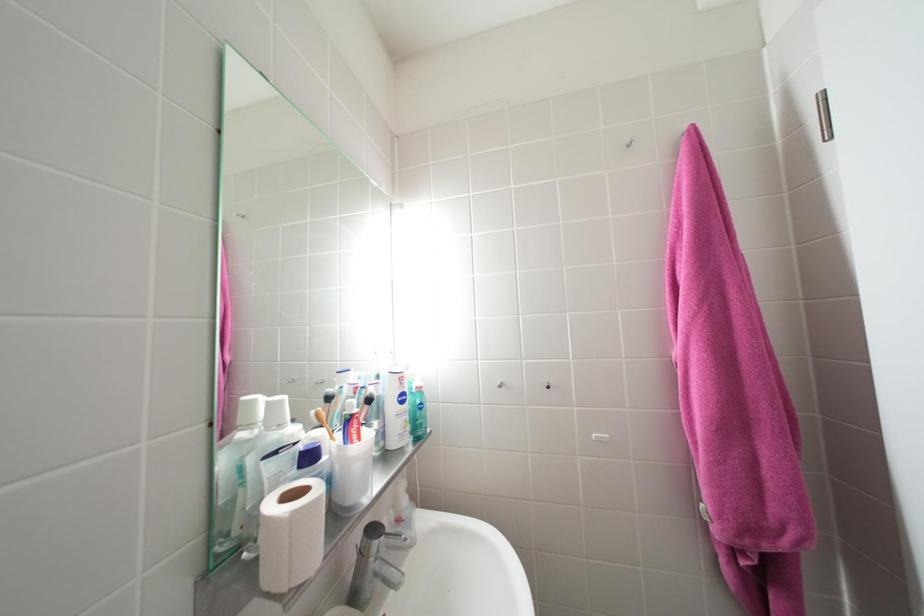
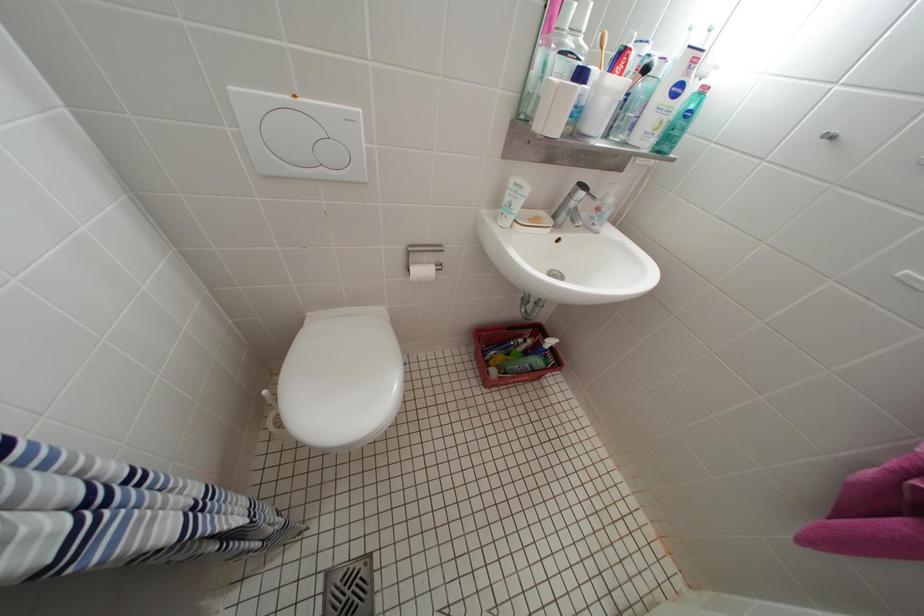
First-person continuous shooting, in which direction is the camera rotating?

The rotation direction of the camera is left-down.